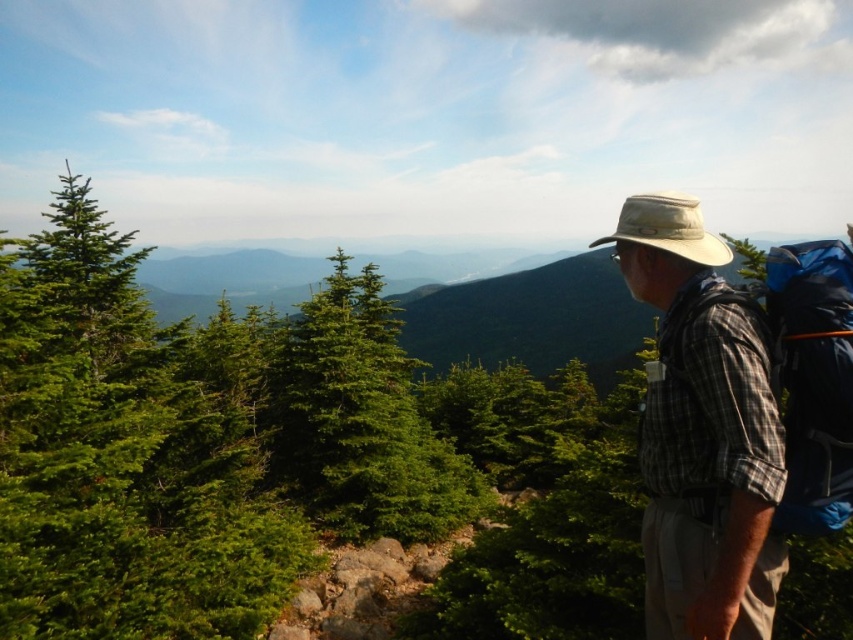
You are a photographer planning to capture a landscape shot of the green matte tree at left and the blue fabric backpack at right. Based on their sizes in the image, which object would you focus on first if you want to ensure both are in sharp focus?

The green matte tree at left is wider than the blue fabric backpack at right, so focusing on the wider green matte tree at left would ensure both are in sharp focus.